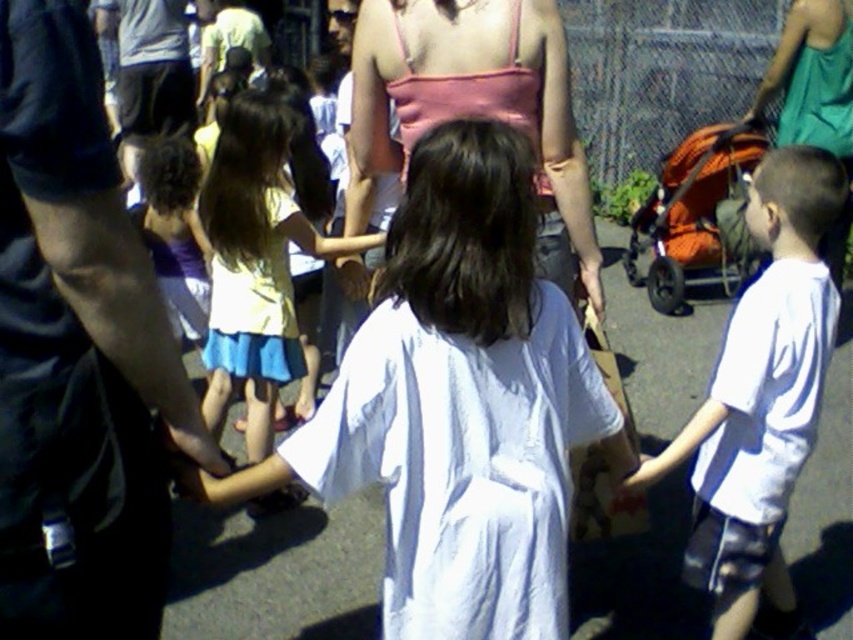
Is point (355, 474) more distant than point (263, 289)?

No, it is in front of (263, 289).

Who is lower down, pink fabric dress at center or yellow fabric dress at center?

Positioned lower is pink fabric dress at center.

Does point (381, 298) come farther from viewer compared to point (282, 324)?

No, (381, 298) is in front of (282, 324).

At what (x,y) coordinates should I click in order to perform the action: click on pink fabric dress at center. Please return your answer as a coordinate pair (x, y). This screenshot has height=640, width=853. Looking at the image, I should click on (457, 404).

Who is more distant from viewer, (366, 38) or (302, 368)?

The point (302, 368) is behind.

Does point (381, 100) lie behind point (242, 308)?

No, it is not.

Is point (531, 116) farther from camera compared to point (300, 358)?

No.

You are a GUI agent. You are given a task and a screenshot of the screen. Output one action in this format:
    pyautogui.click(x=<x>, y=<y>)
    Task: Click on the pink fabric top at center
    The height and width of the screenshot is (640, 853).
    Given the screenshot: What is the action you would take?
    pyautogui.click(x=474, y=93)

Who is higher up, white cotton shirt at right or pink fabric top at center?

pink fabric top at center is above.

Is white cotton shirt at right closer to the viewer compared to pink fabric top at center?

Yes, it is in front of pink fabric top at center.

Locate an element on the screen. Image resolution: width=853 pixels, height=640 pixels. white cotton shirt at right is located at coordinates (761, 403).

I want to click on white cotton shirt at right, so click(761, 403).